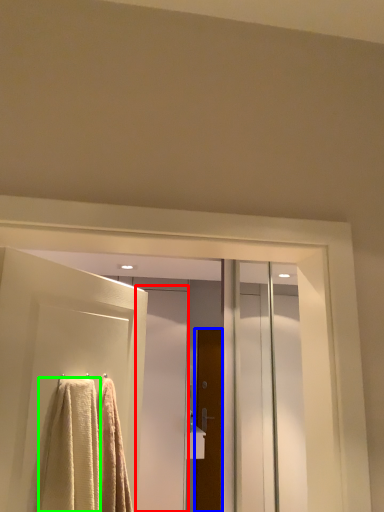
Question: Considering the real-world distances, which object is farthest from screen door (highlighted by a red box)? door (highlighted by a blue box) or towel (highlighted by a green box)?

Choices:
 (A) door
 (B) towel

Answer: (B)